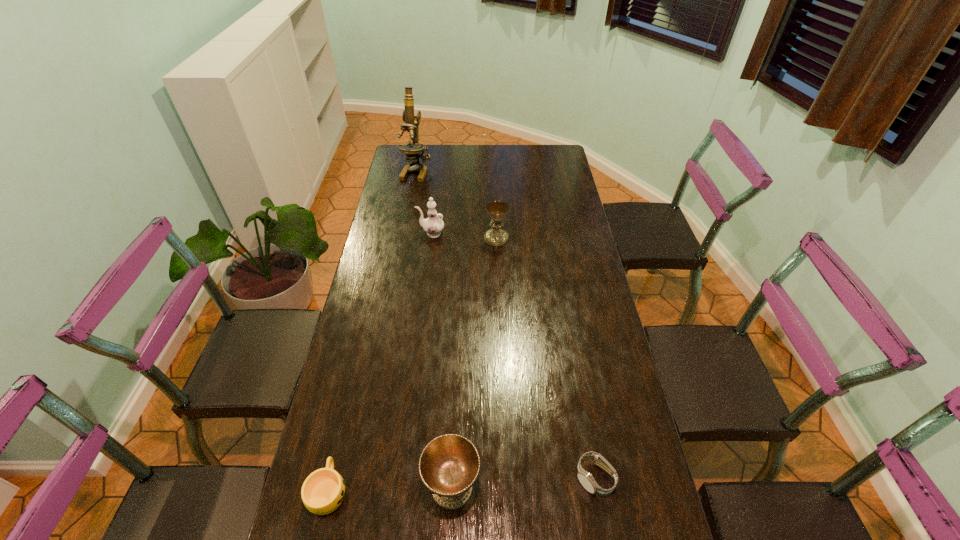
Where is `object that is at the right edge`? Image resolution: width=960 pixels, height=540 pixels. object that is at the right edge is located at coordinates (586, 479).

Find the location of a particular element. This screenshot has width=960, height=540. object that is at the far left corner is located at coordinates (412, 150).

The width and height of the screenshot is (960, 540). Find the location of `vacant space at the far edge of the desktop`. vacant space at the far edge of the desktop is located at coordinates (485, 154).

This screenshot has height=540, width=960. I want to click on blank space at the left edge of the desktop, so [x=425, y=177].

Where is `vacant space at the right edge of the desktop`? This screenshot has height=540, width=960. vacant space at the right edge of the desktop is located at coordinates (547, 224).

The width and height of the screenshot is (960, 540). In the image, there is a desktop. Identify the location of vacant space at the far right corner. (539, 154).

Identify the location of vacant space that's between the watch and the left chalice. (523, 482).

This screenshot has height=540, width=960. What are the coordinates of `empty location between the right chalice and the chinaware` in the screenshot? It's located at (464, 236).

This screenshot has height=540, width=960. I want to click on free space between the rightmost object and the chinaware, so [513, 355].

Locate an element on the screen. This screenshot has width=960, height=540. vacant space that is in between the chinaware and the fourth object from left to right is located at coordinates (442, 360).